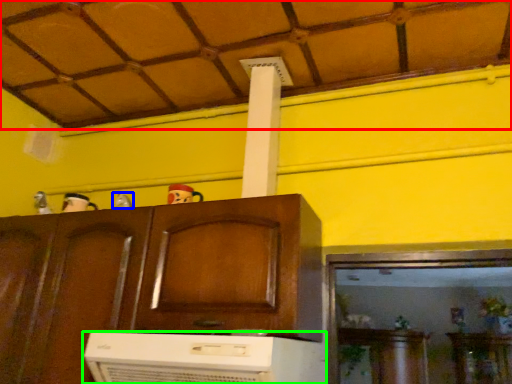
Question: Which object is the farthest from tile roof (highlighted by a red box)? Choose among these: toy (highlighted by a blue box) or home appliance (highlighted by a green box).

Choices:
 (A) toy
 (B) home appliance

Answer: (B)